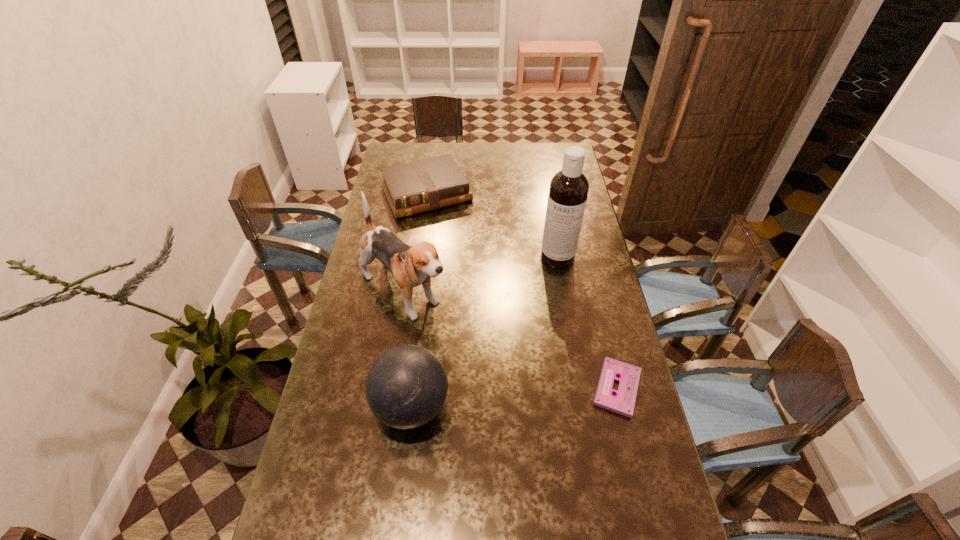
Find the location of a particular element. This screenshot has height=540, width=960. videotape present at the right edge is located at coordinates (623, 402).

Image resolution: width=960 pixels, height=540 pixels. In order to click on dishwasher detergent positioned at the right edge in this screenshot , I will do `click(568, 191)`.

Where is `vacant space at the far edge`? vacant space at the far edge is located at coordinates (467, 167).

In the image, there is a desktop. In order to click on vacant space at the left edge in this screenshot , I will do point(375,333).

The image size is (960, 540). What are the coordinates of `free space at the right edge of the desktop` in the screenshot? It's located at (578, 336).

Find the location of a particular element. The height and width of the screenshot is (540, 960). free space between the Bible and the videotape is located at coordinates (521, 291).

You are a GUI agent. You are given a task and a screenshot of the screen. Output one action in this format:
    pyautogui.click(x=<x>, y=<y>)
    Task: Click on the vacant point located between the dishwasher detergent and the Bible
    
    Given the screenshot: What is the action you would take?
    pyautogui.click(x=492, y=225)

In order to click on vacant area between the dishwasher detergent and the puppy in this screenshot , I will do `click(481, 275)`.

In order to click on vacant area between the dishwasher detergent and the third shortest object in this screenshot , I will do `click(485, 332)`.

Where is `free space between the fourth tallest object and the shortest object`? free space between the fourth tallest object and the shortest object is located at coordinates (521, 291).